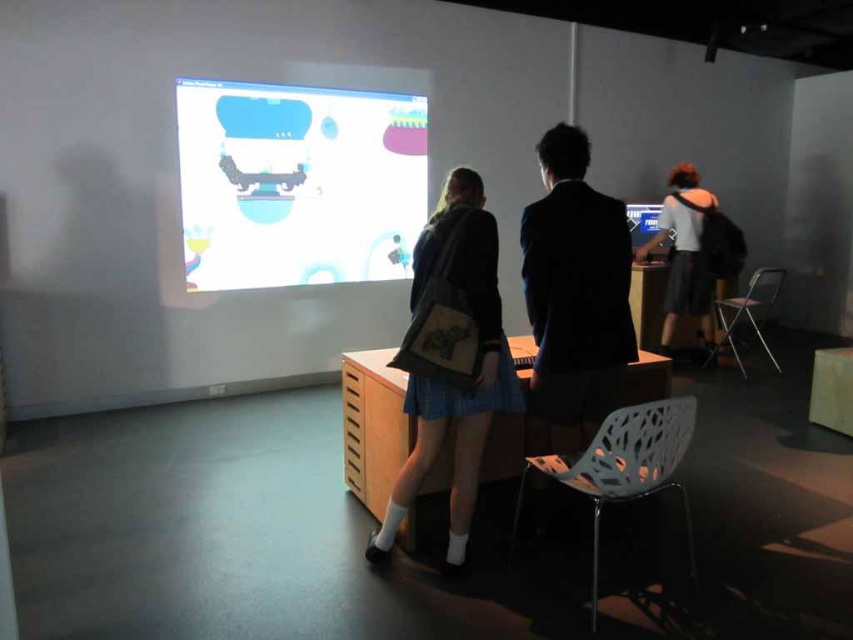
Where is `gray fabric shirt at center right`? This screenshot has width=853, height=640. gray fabric shirt at center right is located at coordinates (683, 253).

Between point (663, 202) and point (671, 234), which one is positioned in front?

Point (663, 202) is in front.

Between point (700, 280) and point (640, 228), which one is positioned in front?

Point (700, 280)

This screenshot has width=853, height=640. I want to click on gray fabric shirt at center right, so click(683, 253).

Does denim skirt at center appear on the left side of black matte suit at center?

Yes, denim skirt at center is to the left of black matte suit at center.

What do you see at coordinates (451, 356) in the screenshot? I see `denim skirt at center` at bounding box center [451, 356].

This screenshot has height=640, width=853. I want to click on denim skirt at center, so click(x=451, y=356).

Which of these two, black matte suit at center or metallic silver chair at right, stands taller?

black matte suit at center is taller.

Can you confirm if black matte suit at center is bigger than metallic silver chair at right?

No.

Who is more distant from viewer, (596, 248) or (766, 344)?

Point (766, 344)

I want to click on black matte suit at center, so click(x=575, y=292).